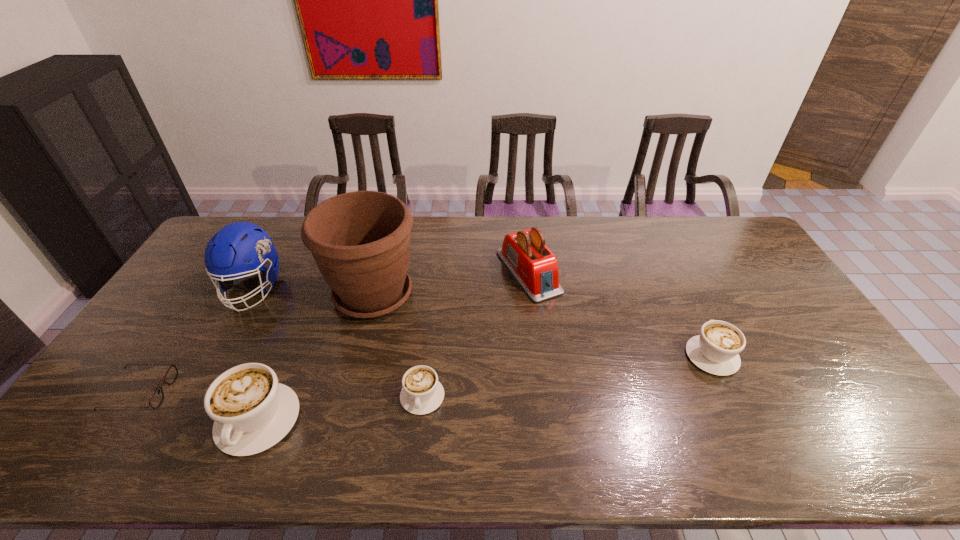
Image resolution: width=960 pixels, height=540 pixels. I want to click on vacant position for inserting another cappuccino evenly, so click(573, 375).